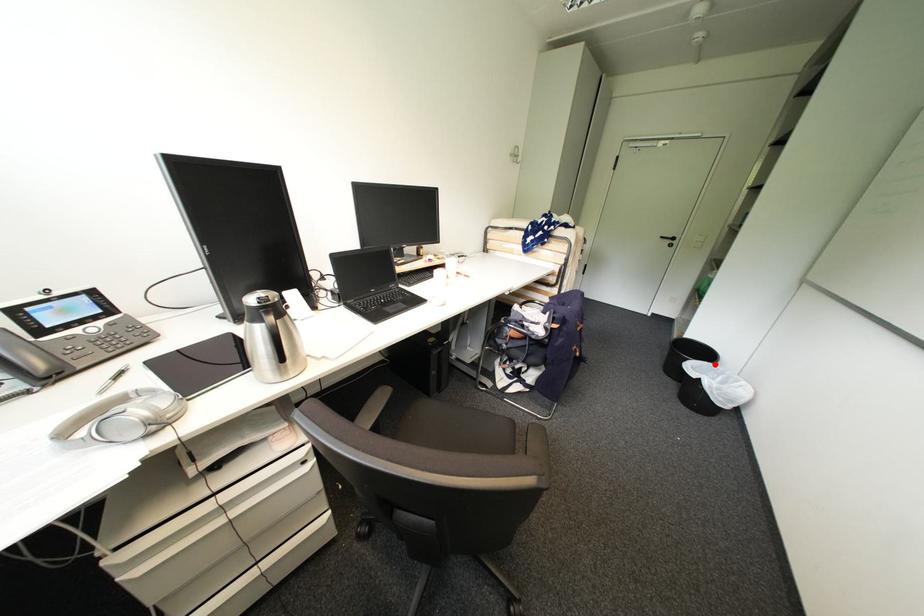
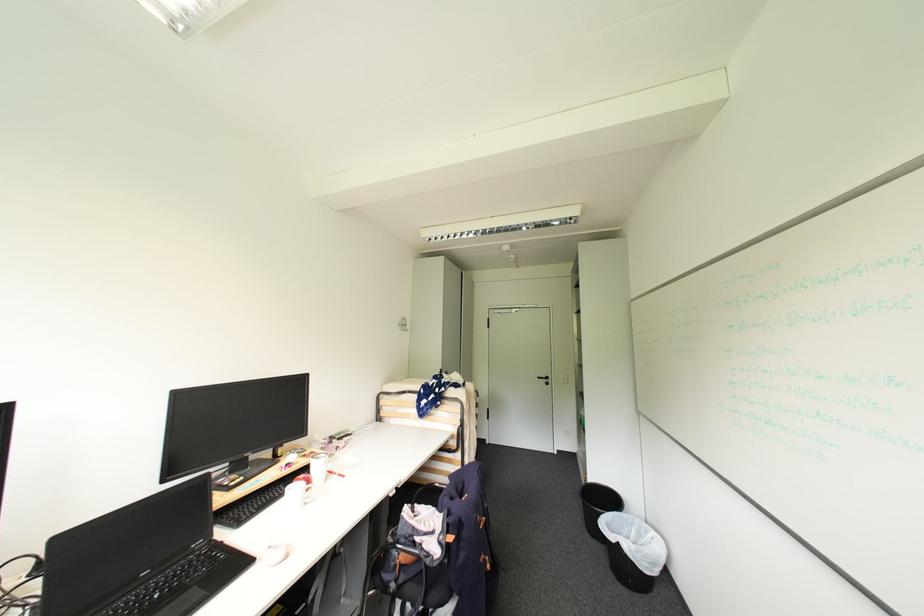
Where in the second image is the point corresponding to the highlighted location from the first image?

(624, 514)